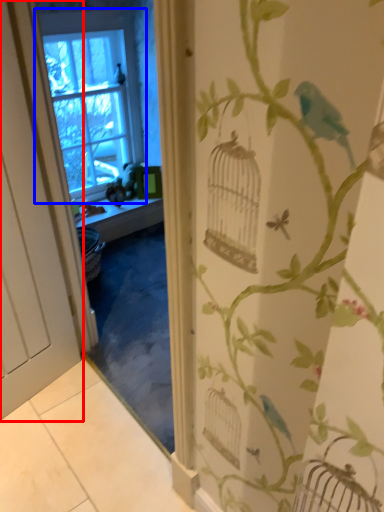
Question: Among these objects, which one is nearest to the camera, door (highlighted by a red box) or window (highlighted by a blue box)?

Choices:
 (A) door
 (B) window

Answer: (A)